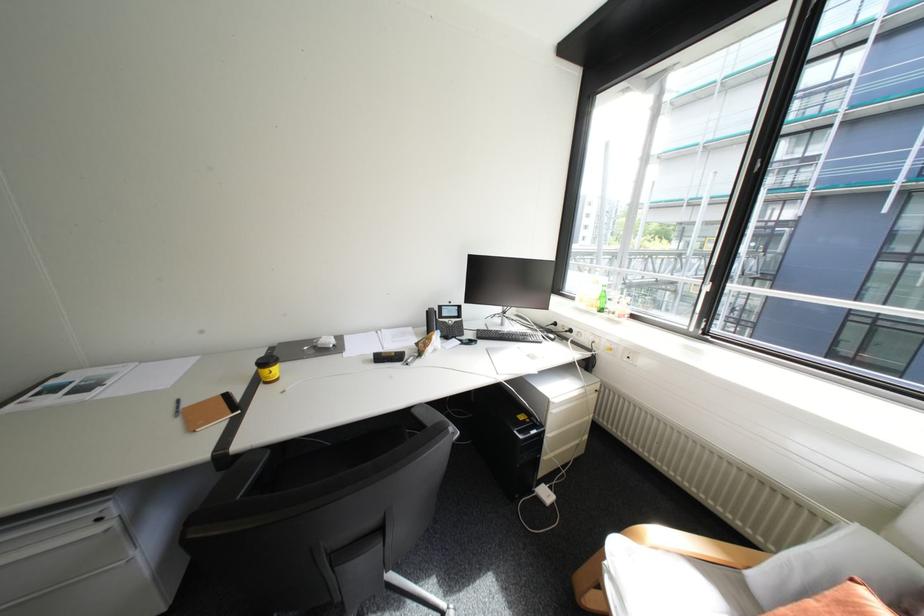
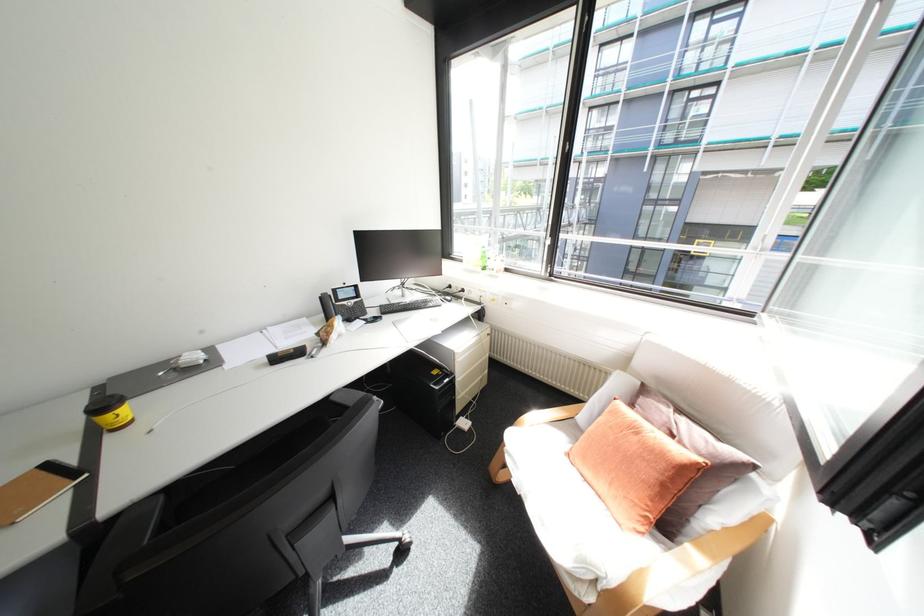
Find the pixel in the second image that matches point 467,338 in the first image.

(371, 317)